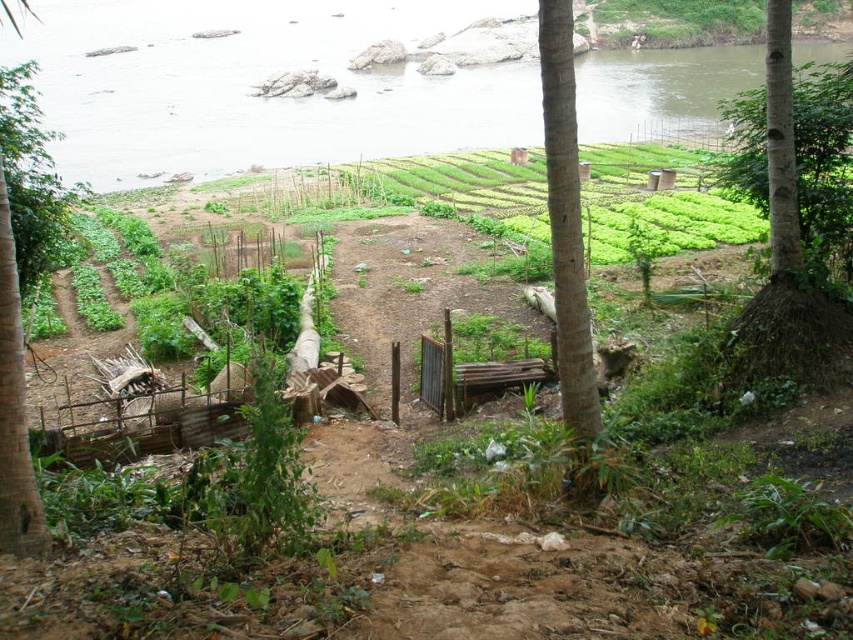
Is green rough bark tree at right to the left of brown rough tree trunk at center from the viewer's perspective?

Incorrect, green rough bark tree at right is not on the left side of brown rough tree trunk at center.

Between green rough bark tree at right and brown rough tree trunk at center, which one has less height?

brown rough tree trunk at center is shorter.

Measure the distance between green rough bark tree at right and camera.

green rough bark tree at right and camera are 30.18 feet apart from each other.

The height and width of the screenshot is (640, 853). What are the coordinates of `green rough bark tree at right` in the screenshot? It's located at (x=787, y=225).

Which is below, brown rough tree trunk at center or smooth bark tree at right?

brown rough tree trunk at center

Where is `brown rough tree trunk at center`? The width and height of the screenshot is (853, 640). brown rough tree trunk at center is located at coordinates (566, 221).

Where is `brown rough tree trunk at center`? Image resolution: width=853 pixels, height=640 pixels. brown rough tree trunk at center is located at coordinates (566, 221).

Is green rough bark tree at right wider than smooth bark tree at right?

Correct, the width of green rough bark tree at right exceeds that of smooth bark tree at right.

From the picture: Who is more forward, (827, 332) or (779, 157)?

Point (779, 157)

Describe the element at coordinates (787, 225) in the screenshot. I see `green rough bark tree at right` at that location.

Where is `green rough bark tree at right`? green rough bark tree at right is located at coordinates (787, 225).